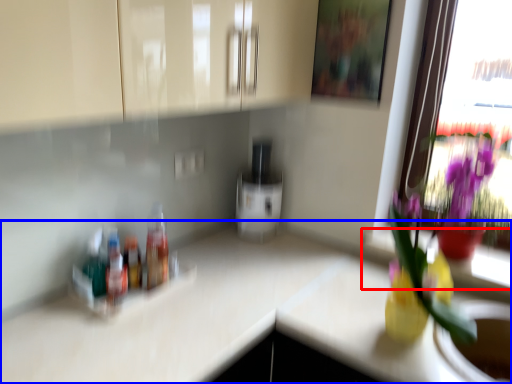
Question: Which object is further to the camera taking this photo, window sill (highlighted by a red box) or countertop (highlighted by a blue box)?

Choices:
 (A) window sill
 (B) countertop

Answer: (A)